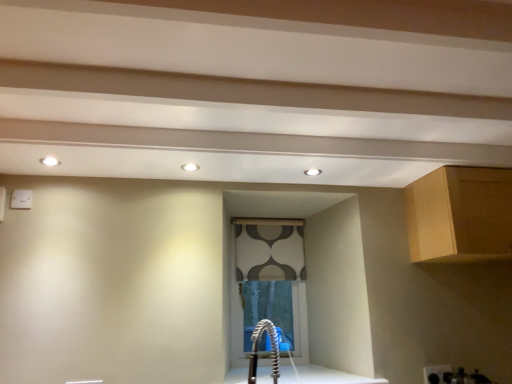
Measure the distance between point (272,368) and camera.

Point (272,368) and camera are 2.39 meters apart.

The height and width of the screenshot is (384, 512). What are the coordinates of `white glossy countertop at center` in the screenshot? It's located at (322, 376).

Can you tell me how much white glossy countertop at center and light brown wood cabinet at upper right differ in facing direction?

The angle between the facing direction of white glossy countertop at center and the facing direction of light brown wood cabinet at upper right is 0.656 degrees.

In terms of width, does white glossy countertop at center look wider or thinner when compared to light brown wood cabinet at upper right?

In the image, white glossy countertop at center appears to be wider than light brown wood cabinet at upper right.

Relative to light brown wood cabinet at upper right, is white glossy countertop at center in front or behind?

white glossy countertop at center is behind light brown wood cabinet at upper right.

Is white glossy countertop at center far away from light brown wood cabinet at upper right?

They are positioned close to each other.

From the image's perspective, would you say satin nickel faucet at lower center is positioned over white glossy countertop at center?

Correct, satin nickel faucet at lower center appears higher than white glossy countertop at center in the image.

Can you confirm if satin nickel faucet at lower center is positioned to the left of white glossy countertop at center?

Indeed, satin nickel faucet at lower center is positioned on the left side of white glossy countertop at center.

From a real-world perspective, between satin nickel faucet at lower center and white glossy countertop at center, who is vertically lower?

white glossy countertop at center is physically lower.

Based on the photo, considering the relative sizes of satin nickel faucet at lower center and white glossy countertop at center in the image provided, is satin nickel faucet at lower center taller than white glossy countertop at center?

Indeed, satin nickel faucet at lower center has a greater height compared to white glossy countertop at center.

Are light brown wood cabinet at upper right and satin nickel faucet at lower center far apart?

Yes, light brown wood cabinet at upper right and satin nickel faucet at lower center are quite far apart.

Is light brown wood cabinet at upper right in front of or behind satin nickel faucet at lower center in the image?

Clearly, light brown wood cabinet at upper right is behind satin nickel faucet at lower center.

Measure the distance between light brown wood cabinet at upper right and satin nickel faucet at lower center.

light brown wood cabinet at upper right is 3.56 feet away from satin nickel faucet at lower center.

Is satin nickel faucet at lower center at the back of light brown wood cabinet at upper right?

light brown wood cabinet at upper right is not turned away from satin nickel faucet at lower center.

Does patterned fabric window at center contain white glossy countertop at center?

Definitely not — white glossy countertop at center is not inside patterned fabric window at center.

From the image's perspective, is patterned fabric window at center positioned above or below white glossy countertop at center?

Clearly, from the image's perspective, patterned fabric window at center is above white glossy countertop at center.

Is patterned fabric window at center oriented away from white glossy countertop at center?

patterned fabric window at center does not have its back to white glossy countertop at center.

Can you tell me how much patterned fabric window at center and white glossy countertop at center differ in facing direction?

The facing directions of patterned fabric window at center and white glossy countertop at center are 0.809 degrees apart.

Is patterned fabric window at center completely or partially outside of satin nickel faucet at lower center?

patterned fabric window at center is positioned outside satin nickel faucet at lower center.

Are patterned fabric window at center and satin nickel faucet at lower center located far from each other?

No, patterned fabric window at center is not far from satin nickel faucet at lower center.

Could you tell me if patterned fabric window at center is facing satin nickel faucet at lower center?

Yes, patterned fabric window at center is turned towards satin nickel faucet at lower center.

Can you tell me how much patterned fabric window at center and satin nickel faucet at lower center differ in facing direction?

There is a 41.1-degree angle between the facing directions of patterned fabric window at center and satin nickel faucet at lower center.

Is white glossy countertop at center with satin nickel faucet at lower center?

No, white glossy countertop at center is not in contact with satin nickel faucet at lower center.

Is white glossy countertop at center taller or shorter than satin nickel faucet at lower center?

white glossy countertop at center is shorter than satin nickel faucet at lower center.

Between point (335, 382) and point (249, 363), which one is positioned behind?

The point (249, 363) is behind.

From a real-world perspective, is white glossy countertop at center on top of patterned fabric window at center?

No.

Could you tell me if white glossy countertop at center is turned towards patterned fabric window at center?

No, white glossy countertop at center does not turn towards patterned fabric window at center.

Is white glossy countertop at center taller than patterned fabric window at center?

No, white glossy countertop at center is not taller than patterned fabric window at center.

Is white glossy countertop at center wider than patterned fabric window at center?

Correct, the width of white glossy countertop at center exceeds that of patterned fabric window at center.

Find the location of a particular element. counter top behind the light brown wood cabinet at upper right is located at coordinates (322, 376).

What are the coordinates of `counter top on the right of the satin nickel faucet at lower center` in the screenshot? It's located at click(x=322, y=376).

Looking at the image, which one is located further to patterned fabric window at center, satin nickel faucet at lower center or light brown wood cabinet at upper right?

Based on the image, light brown wood cabinet at upper right appears to be further to patterned fabric window at center.

Considering their positions, is light brown wood cabinet at upper right positioned closer to white glossy countertop at center than satin nickel faucet at lower center?

satin nickel faucet at lower center is positioned closer to the anchor white glossy countertop at center.

Considering their positions, is light brown wood cabinet at upper right positioned further to patterned fabric window at center than satin nickel faucet at lower center?

Among the two, light brown wood cabinet at upper right is located further to patterned fabric window at center.

Based on the photo, looking at the image, which one is located further to patterned fabric window at center, white glossy countertop at center or satin nickel faucet at lower center?

The object further to patterned fabric window at center is white glossy countertop at center.

Estimate the real-world distances between objects in this image. Which object is closer to white glossy countertop at center, satin nickel faucet at lower center or patterned fabric window at center?

Among the two, satin nickel faucet at lower center is located nearer to white glossy countertop at center.

Which object lies nearer to the anchor point satin nickel faucet at lower center, white glossy countertop at center or patterned fabric window at center?

white glossy countertop at center.

Considering their positions, is white glossy countertop at center positioned closer to light brown wood cabinet at upper right than satin nickel faucet at lower center?

Among the two, white glossy countertop at center is located nearer to light brown wood cabinet at upper right.

From the image, which object appears to be nearer to light brown wood cabinet at upper right, white glossy countertop at center or patterned fabric window at center?

white glossy countertop at center is positioned closer to the anchor light brown wood cabinet at upper right.

Find the location of a particular element. The height and width of the screenshot is (384, 512). counter top between satin nickel faucet at lower center and patterned fabric window at center in the front-back direction is located at coordinates (322, 376).

Identify the location of counter top located between patterned fabric window at center and light brown wood cabinet at upper right in the left-right direction. (322, 376).

I want to click on window located between satin nickel faucet at lower center and light brown wood cabinet at upper right in the left-right direction, so [269, 285].

Locate an element on the screen. The width and height of the screenshot is (512, 384). counter top between satin nickel faucet at lower center and light brown wood cabinet at upper right from left to right is located at coordinates (322, 376).